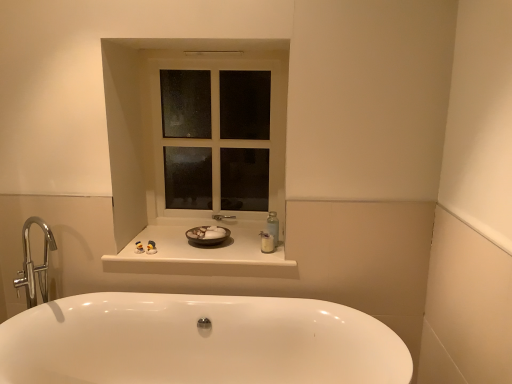
Question: Is point (234, 236) positioned closer to the camera than point (166, 337)?

Choices:
 (A) closer
 (B) farther

Answer: (B)

Question: Would you say white glossy counter top at center is to the left or to the right of white glossy bathtub at lower center in the picture?

Choices:
 (A) left
 (B) right

Answer: (A)

Question: Considering the real-world distances, which object is closest to the translucent plastic bottle at center, the second toiletry positioned from the left?

Choices:
 (A) brown matte bowl at center
 (B) white glossy bathtub at lower center
 (C) white glass window at center
 (D) white glossy counter top at center
 (E) white glossy toiletries at center, arranged as the 2th toiletry when viewed from the right

Answer: (A)

Question: Considering the real-world distances, which object is farthest from the white glossy counter top at center?

Choices:
 (A) white glossy toiletries at center, the 1th toiletry in the left-to-right sequence
 (B) translucent plastic bottle at center, the 1th toiletry in the right-to-left sequence
 (C) white glass window at center
 (D) brown matte bowl at center
 (E) white glossy bathtub at lower center

Answer: (C)